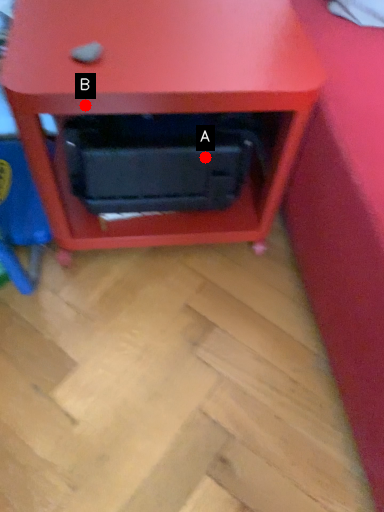
Question: Two points are circled on the image, labeled by A and B beside each circle. Which point is further to the camera?

Choices:
 (A) A is further
 (B) B is further

Answer: (A)